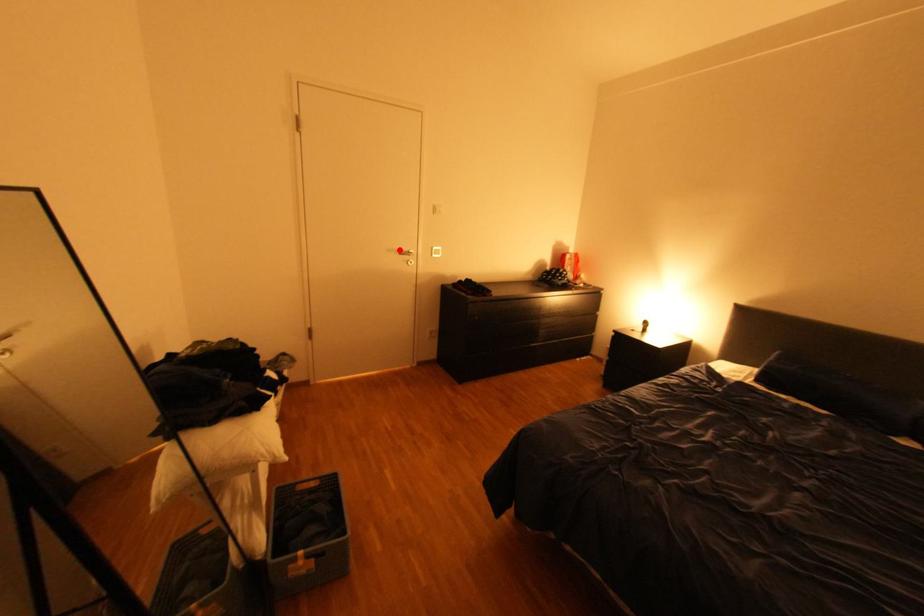
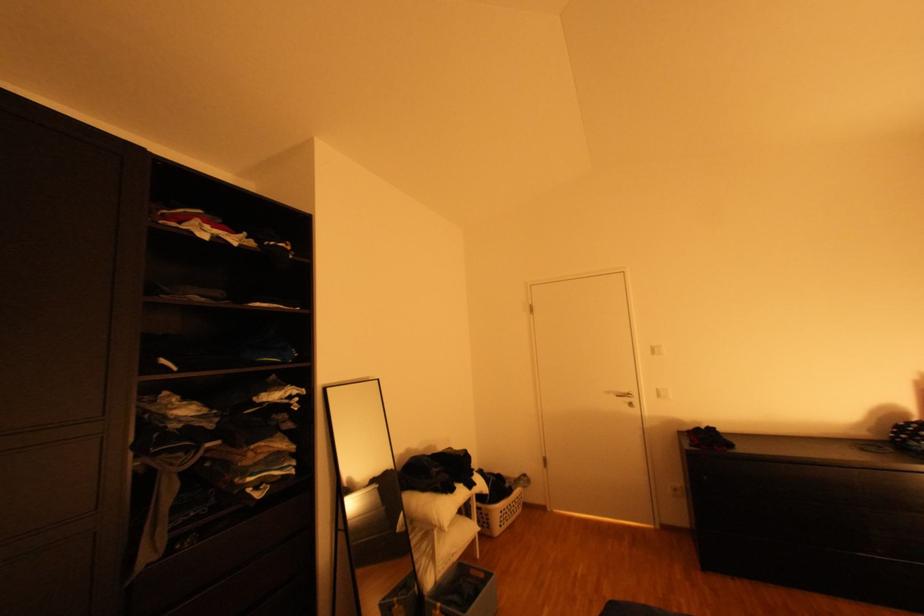
Where in the second image is the point corresponding to the highlighted location from the first image?

(617, 392)